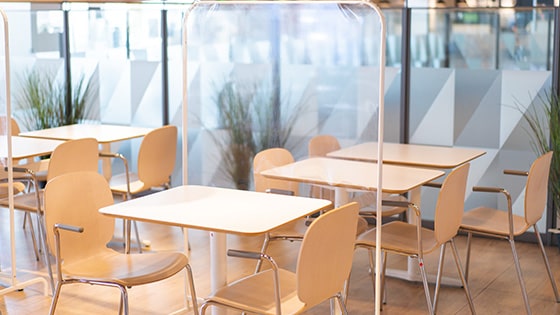
Find the location of a particular element. Image resolution: width=560 pixels, height=315 pixels. white rectangular table is located at coordinates click(233, 221), click(358, 171), click(399, 152), click(99, 129), click(21, 145).